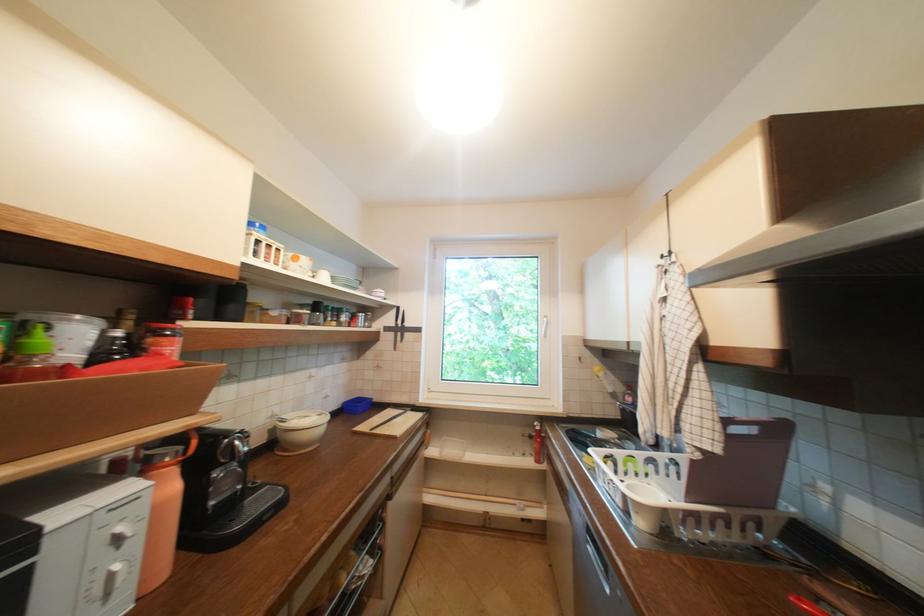
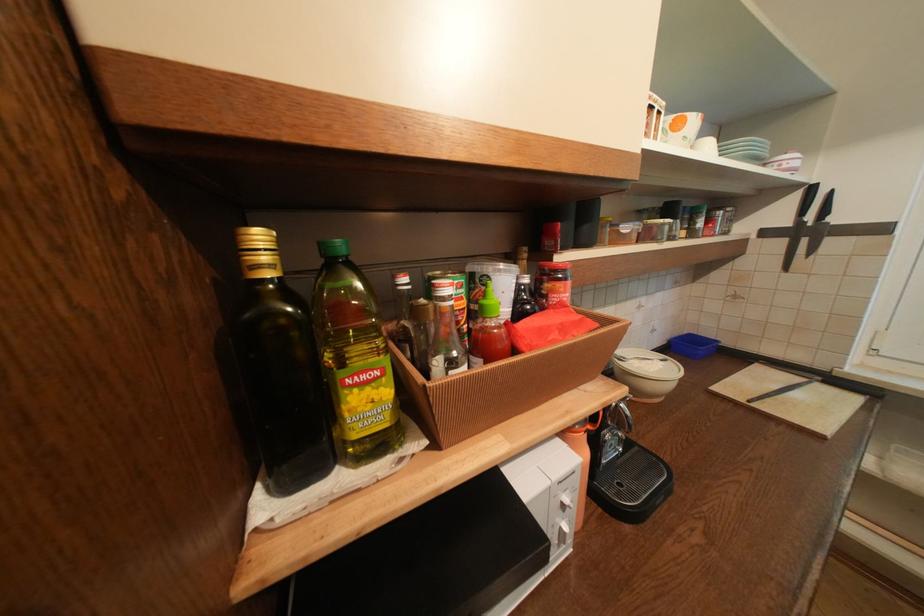
Where in the second image is the point corresponding to pixel 126 541 from the first image?

(573, 507)